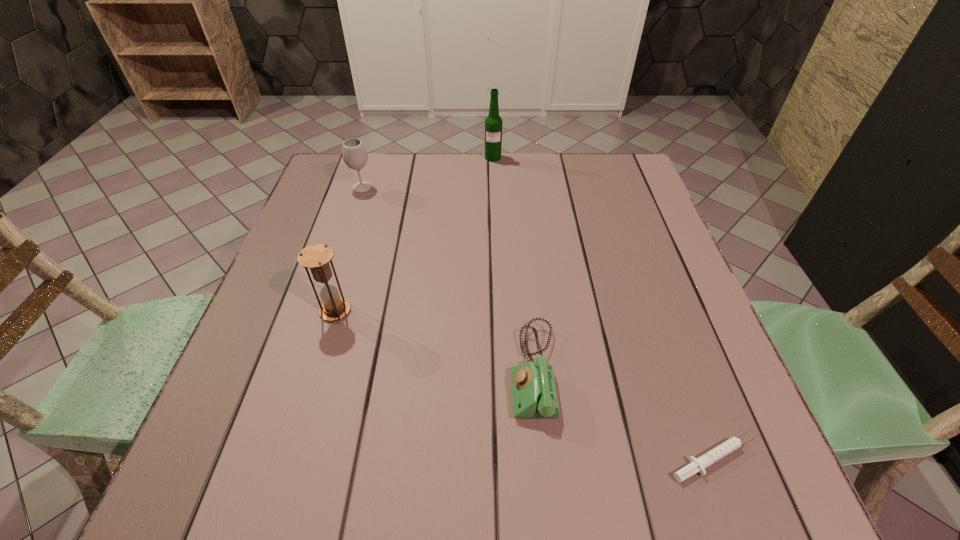
Where is `vacant position at the far right corner of the desktop`? The image size is (960, 540). vacant position at the far right corner of the desktop is located at coordinates (626, 168).

In the image, there is a desktop. What are the coordinates of `free space at the near right corner` in the screenshot? It's located at (678, 493).

Where is `vacant region between the third tallest object and the beer bottle`? The width and height of the screenshot is (960, 540). vacant region between the third tallest object and the beer bottle is located at coordinates click(427, 172).

Identify the location of free space that is in between the telephone and the third farthest object. This screenshot has height=540, width=960. pos(435,341).

Find the location of a particular element. This screenshot has width=960, height=540. vacant space that is in between the second tallest object and the telephone is located at coordinates (435, 341).

Locate an element on the screen. free space between the wineglass and the beer bottle is located at coordinates (427, 172).

Find the location of `free space that is in between the beer bottle and the nearest object`. free space that is in between the beer bottle and the nearest object is located at coordinates (605, 307).

Locate an element on the screen. The height and width of the screenshot is (540, 960). free space between the farthest object and the wineglass is located at coordinates (427, 172).

You are a GUI agent. You are given a task and a screenshot of the screen. Output one action in this format:
    pyautogui.click(x=<x>, y=<y>)
    Task: Click on the vacant point located between the fourth shortest object and the wineglass
    
    Given the screenshot: What is the action you would take?
    pyautogui.click(x=348, y=249)

I want to click on free area in between the wineglass and the nearest object, so click(540, 322).